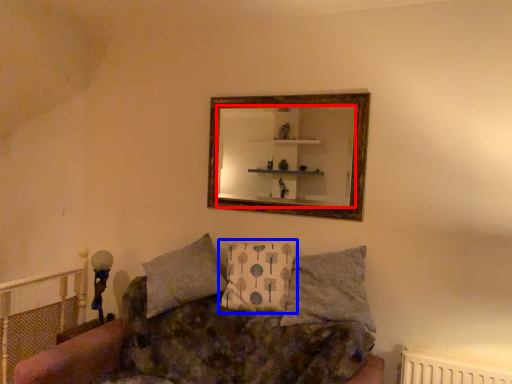
Question: Which point is further to the camera, mirror (highlighted by a red box) or pillow (highlighted by a blue box)?

Choices:
 (A) mirror
 (B) pillow

Answer: (A)